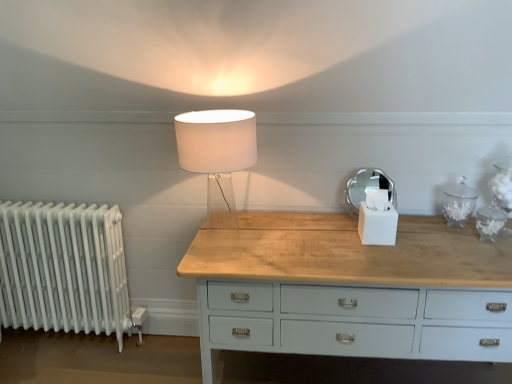
In order to click on translucent glass lamp at center in this screenshot , I will do `click(217, 155)`.

What do you see at coordinates (217, 155) in the screenshot?
I see `translucent glass lamp at center` at bounding box center [217, 155].

Where is `white metallic radiator at left`? Image resolution: width=512 pixels, height=384 pixels. white metallic radiator at left is located at coordinates (65, 269).

Is white matte tissue box at center touching white metallic radiator at left?

white matte tissue box at center and white metallic radiator at left are not in contact.

From a real-world perspective, is white matte tissue box at center above or below white metallic radiator at left?

Clearly, from a real-world perspective, white matte tissue box at center is above white metallic radiator at left.

Identify the location of candle holder above the white metallic radiator at left (from a real-world perspective). (377, 219).

Is white matte tissue box at center shorter than white metallic radiator at left?

Correct, white matte tissue box at center is not as tall as white metallic radiator at left.

Is translucent glass lamp at center positioned beyond the bounds of white matte tissue box at center?

Yes, translucent glass lamp at center is located beyond the bounds of white matte tissue box at center.

From the image's perspective, which is above, translucent glass lamp at center or white matte tissue box at center?

translucent glass lamp at center.

From a real-world perspective, who is located higher, translucent glass lamp at center or white matte tissue box at center?

translucent glass lamp at center, from a real-world perspective.

In the scene shown: Is translucent glass lamp at center with white matte tissue box at center?

There is a gap between translucent glass lamp at center and white matte tissue box at center.

From the picture: Considering the relative sizes of white matte tissue box at center and translucent glass lamp at center in the image provided, is white matte tissue box at center shorter than translucent glass lamp at center?

Indeed, white matte tissue box at center has a lesser height compared to translucent glass lamp at center.

From the image's perspective, who appears lower, white matte tissue box at center or translucent glass lamp at center?

white matte tissue box at center, from the image's perspective.

Between white matte tissue box at center and translucent glass lamp at center, which one is positioned in front?

translucent glass lamp at center is more forward.

How different are the orientations of white matte tissue box at center and translucent glass lamp at center in degrees?

They differ by 1.11 degrees in their facing directions.

Are white metallic radiator at left and translucent glass lamp at center located far from each other?

Indeed, white metallic radiator at left is not near translucent glass lamp at center.

What are the coordinates of `lamp in front of the white metallic radiator at left` in the screenshot? It's located at (217, 155).

From a real-world perspective, is translucent glass lamp at center beneath white metallic radiator at left?

No, from a real-world perspective, translucent glass lamp at center is not under white metallic radiator at left.

Is white metallic radiator at left at the back of translucent glass lamp at center?

No, translucent glass lamp at center is not facing away from white metallic radiator at left.

Which is closer, (210, 193) or (31, 241)?

Clearly, point (210, 193) is more distant from the camera than point (31, 241).

Are translucent glass lamp at center and white metallic radiator at left making contact?

No, translucent glass lamp at center is not touching white metallic radiator at left.

From the image's perspective, is white metallic radiator at left above white matte tissue box at center?

Incorrect, from the image's perspective, white metallic radiator at left is lower than white matte tissue box at center.

Which is correct: white metallic radiator at left is inside white matte tissue box at center, or outside of it?

white metallic radiator at left is spatially situated outside white matte tissue box at center.

Does white metallic radiator at left have a greater height compared to white matte tissue box at center?

Yes.

Considering the relative positions of white metallic radiator at left and white matte tissue box at center in the image provided, is white metallic radiator at left to the right of white matte tissue box at center from the viewer's perspective?

In fact, white metallic radiator at left is to the left of white matte tissue box at center.

I want to click on candle holder lying in front of the white metallic radiator at left, so click(377, 219).

The height and width of the screenshot is (384, 512). Identify the location of lamp to the left of white matte tissue box at center. click(217, 155).

From the image, which object appears to be nearer to white metallic radiator at left, translucent glass lamp at center or white matte tissue box at center?

translucent glass lamp at center lies closer to white metallic radiator at left than the other object.

When comparing their distances from white matte tissue box at center, does translucent glass lamp at center or white metallic radiator at left seem further?

white metallic radiator at left is positioned further to the anchor white matte tissue box at center.

Looking at the image, which one is located further to translucent glass lamp at center, white matte tissue box at center or white metallic radiator at left?

Among the two, white metallic radiator at left is located further to translucent glass lamp at center.

From the picture: When comparing their distances from white metallic radiator at left, does white matte tissue box at center or translucent glass lamp at center seem closer?

Among the two, translucent glass lamp at center is located nearer to white metallic radiator at left.

Looking at the image, which one is located closer to white matte tissue box at center, white metallic radiator at left or translucent glass lamp at center?

translucent glass lamp at center is positioned closer to the anchor white matte tissue box at center.

Estimate the real-world distances between objects in this image. Which object is closer to translucent glass lamp at center, white metallic radiator at left or white matte tissue box at center?

white matte tissue box at center lies closer to translucent glass lamp at center than the other object.

The height and width of the screenshot is (384, 512). I want to click on lamp between white metallic radiator at left and white matte tissue box at center from left to right, so click(x=217, y=155).